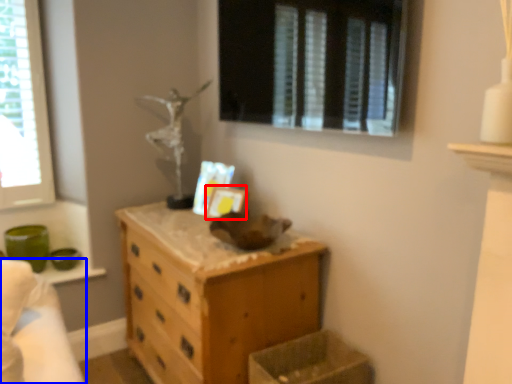
Question: Among these objects, which one is nearest to the camera, picture frame (highlighted by a red box) or bed (highlighted by a blue box)?

Choices:
 (A) picture frame
 (B) bed

Answer: (B)